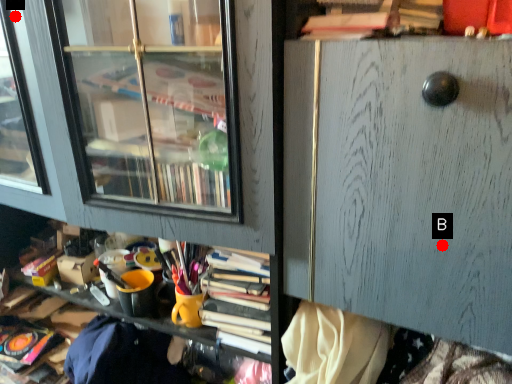
Question: Two points are circled on the image, labeled by A and B beside each circle. Which point is closer to the camera taking this photo?

Choices:
 (A) A is closer
 (B) B is closer

Answer: (B)